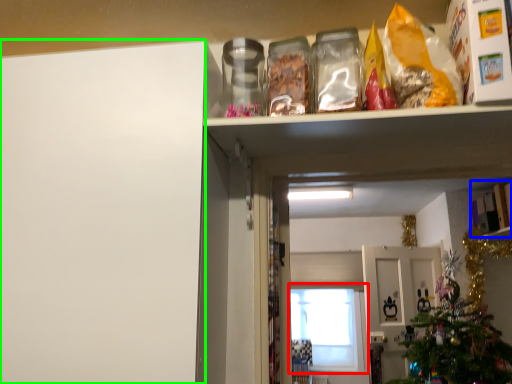
Question: Based on their relative distances, which object is farther from window (highlighted by a red box)? Choose from cabinet (highlighted by a blue box) and leftover (highlighted by a green box).

Choices:
 (A) cabinet
 (B) leftover

Answer: (B)